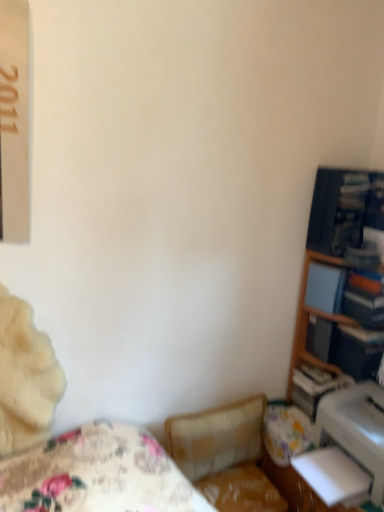
Question: Is hardcover book at right, placed as the 2th paperback book when sorted from top to bottom, far away from wooden bookshelf at right?

Choices:
 (A) yes
 (B) no

Answer: (B)

Question: Is the position of hardcover book at right, positioned as the 1th paperback book in bottom-to-top order, less distant than that of wooden bookshelf at right?

Choices:
 (A) yes
 (B) no

Answer: (B)

Question: Does hardcover book at right, positioned as the 1th paperback book in bottom-to-top order, come behind wooden bookshelf at right?

Choices:
 (A) no
 (B) yes

Answer: (B)

Question: Is hardcover book at right, positioned as the 1th paperback book in bottom-to-top order, bigger than wooden bookshelf at right?

Choices:
 (A) no
 (B) yes

Answer: (A)

Question: From the image's perspective, is hardcover book at right, placed as the 2th paperback book when sorted from top to bottom, on wooden bookshelf at right?

Choices:
 (A) no
 (B) yes

Answer: (A)

Question: Is hardcover book at right, which is counted as the first paperback book, starting from the right, at the left side of wooden bookshelf at right?

Choices:
 (A) no
 (B) yes

Answer: (A)

Question: From a real-world perspective, does white glossy printer at lower right sit lower than hardcover book at right, placed as the 2th paperback book when sorted from top to bottom?

Choices:
 (A) no
 (B) yes

Answer: (B)

Question: Does white glossy printer at lower right come behind hardcover book at right, which is counted as the first paperback book, starting from the right?

Choices:
 (A) no
 (B) yes

Answer: (A)

Question: From the image's perspective, is white glossy printer at lower right located beneath hardcover book at right, placed as the 2th paperback book when sorted from top to bottom?

Choices:
 (A) yes
 (B) no

Answer: (A)

Question: Considering the relative sizes of white glossy printer at lower right and hardcover book at right, positioned as the 1th paperback book in bottom-to-top order, in the image provided, is white glossy printer at lower right bigger than hardcover book at right, positioned as the 1th paperback book in bottom-to-top order,?

Choices:
 (A) no
 (B) yes

Answer: (B)

Question: Is white glossy printer at lower right thinner than hardcover book at right, placed as the 2th paperback book when sorted from top to bottom?

Choices:
 (A) no
 (B) yes

Answer: (A)

Question: From the image's perspective, is white glossy printer at lower right on hardcover book at right, which is counted as the first paperback book, starting from the right?

Choices:
 (A) no
 (B) yes

Answer: (A)

Question: Does wooden bookshelf at right turn towards matte blue paperback book at right, the second paperback book viewed from the right?

Choices:
 (A) no
 (B) yes

Answer: (B)